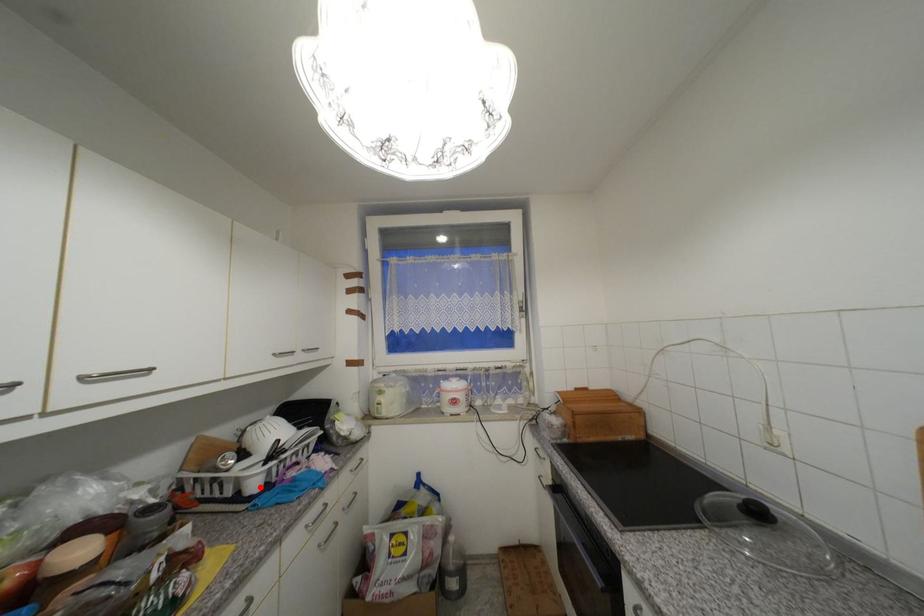
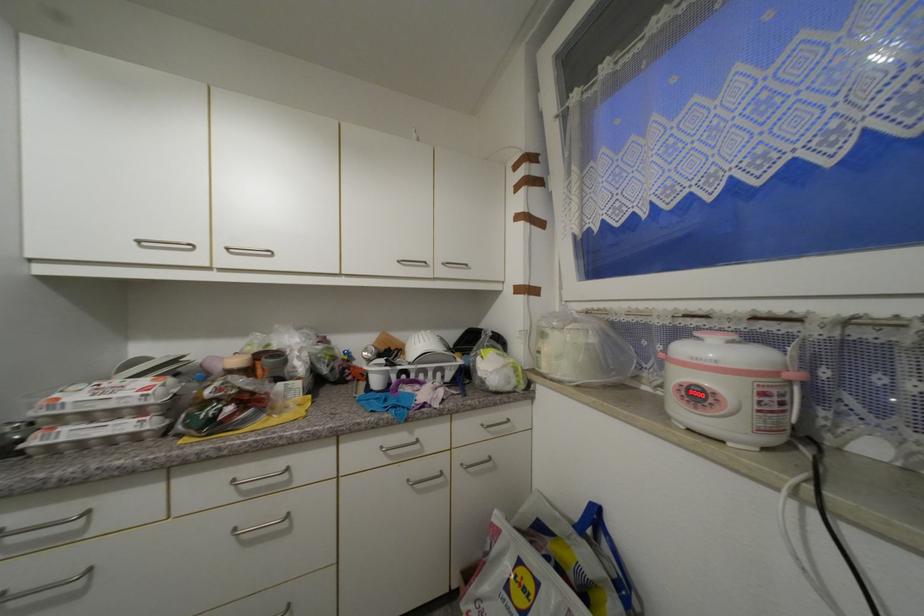
The point at the highlighted location is marked in the first image. Where is the corresponding point in the second image?

(382, 384)